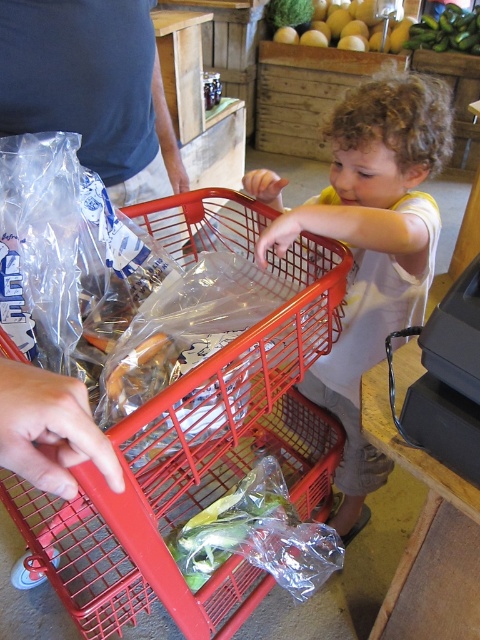
You are a parent trying to help your child reach the yellow smooth melon at center in the grocery store. The red plastic shopping cart at center is between you and the melon. Can the shopping cart fit through the narrow aisle between the shelves to get closer to the melon?

The red plastic shopping cart at center is thinner than the yellow smooth melon at center, so it can fit through the narrow aisle between the shelves to get closer to the melon.

You are a parent trying to ensure your child doesn t reach into the red plastic shopping cart at center and the yellow smooth melon at center. Based on their sizes, which object should you be more cautious about your child touching?

The red plastic shopping cart at center is bigger than the yellow smooth melon at center, so you should be more cautious about the child touching the red plastic shopping cart at center since it is larger and might pose a bigger risk if the child interacts with it improperly.